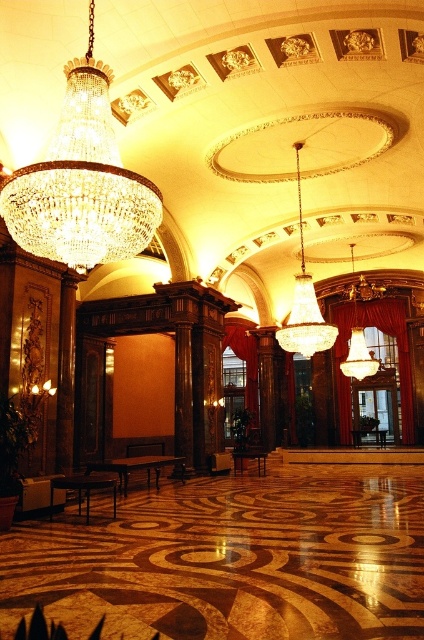
Is crystal glass chandelier at upper left below matte gold chandelier at center?

Actually, crystal glass chandelier at upper left is above matte gold chandelier at center.

At what (x,y) coordinates should I click in order to perform the action: click on crystal glass chandelier at upper left. Please return your answer as a coordinate pair (x, y). Looking at the image, I should click on (81, 182).

Between point (106, 92) and point (359, 332), which one is positioned behind?

Positioned behind is point (359, 332).

Find the location of `crystal glass chandelier at upper left`. crystal glass chandelier at upper left is located at coordinates (81, 182).

What do you see at coordinates (304, 301) in the screenshot? The width and height of the screenshot is (424, 640). I see `crystal chandelier at center` at bounding box center [304, 301].

Is point (317, 324) less distant than point (359, 336)?

Yes, it is in front of point (359, 336).

Locate an element on the screen. Image resolution: width=424 pixels, height=640 pixels. crystal chandelier at center is located at coordinates (304, 301).

Which of these two, crystal glass chandelier at upper left or crystal chandelier at center, stands shorter?

crystal glass chandelier at upper left

In the scene shown: Is crystal glass chandelier at upper left smaller than crystal chandelier at center?

Yes, crystal glass chandelier at upper left is smaller than crystal chandelier at center.

The width and height of the screenshot is (424, 640). Describe the element at coordinates (81, 182) in the screenshot. I see `crystal glass chandelier at upper left` at that location.

Find the location of a particular element. crystal glass chandelier at upper left is located at coordinates (81, 182).